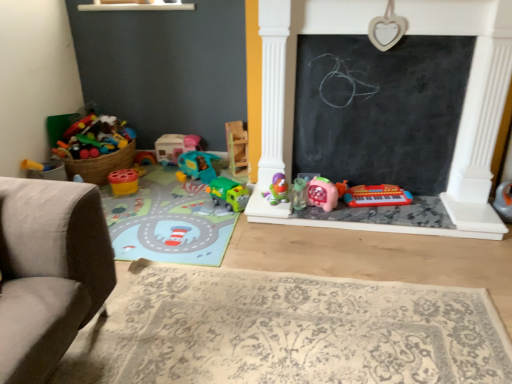
The height and width of the screenshot is (384, 512). Identify the location of empty space that is in between teal plastic toy car at center, which appears as the 3th toy when viewed from the left, and matte plastic cup at center-left, which is the first toy in left-to-right order. (160, 181).